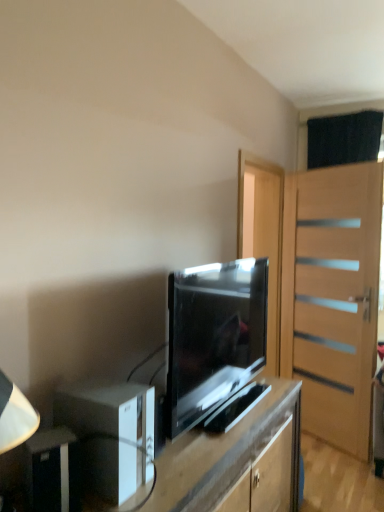
Identify the location of vacant space to the right of white glossy speaker at lower left, the 1th appliance viewed from the back. The height and width of the screenshot is (512, 384). (177, 477).